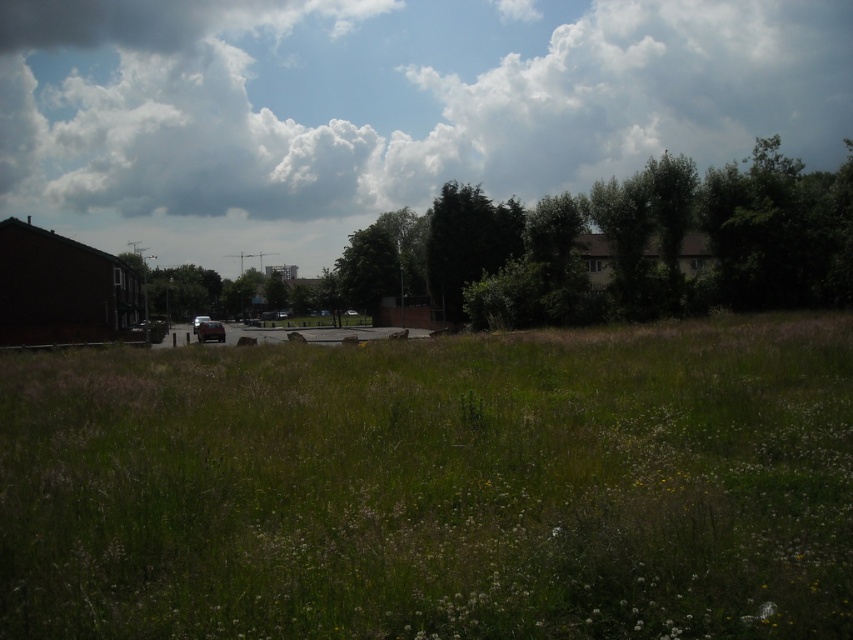
Question: Which of these objects is positioned farthest from the green grass at center?

Choices:
 (A) green leafy tree at center
 (B) matte black car at center
 (C) shiny silver car at center

Answer: (B)

Question: From the image, what is the correct spatial relationship of cloudy sky at upper center in relation to matte black car at center?

Choices:
 (A) left
 (B) right

Answer: (B)

Question: Which point is closer to the camera taking this photo?

Choices:
 (A) (204, 316)
 (B) (376, 371)
 (C) (198, 332)
 (D) (695, 198)

Answer: (B)

Question: Does green grassy field at center appear over green grass at center?

Choices:
 (A) no
 (B) yes

Answer: (A)

Question: Which of the following is the closest to the observer?

Choices:
 (A) (199, 324)
 (B) (198, 323)
 (C) (344, 317)
 (D) (593, 216)

Answer: (D)

Question: Can you confirm if green grassy field at center is positioned to the right of cloudy sky at upper center?

Choices:
 (A) yes
 (B) no

Answer: (A)